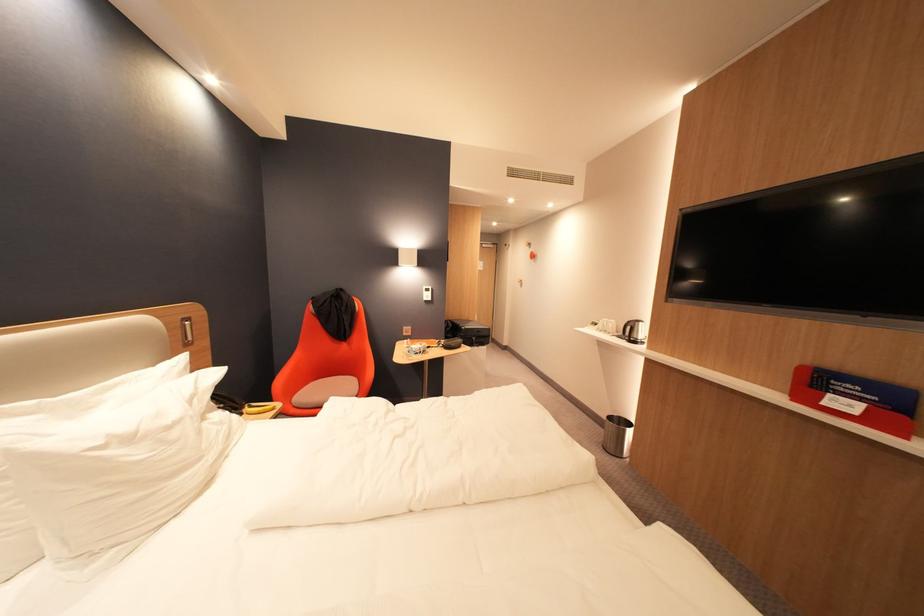
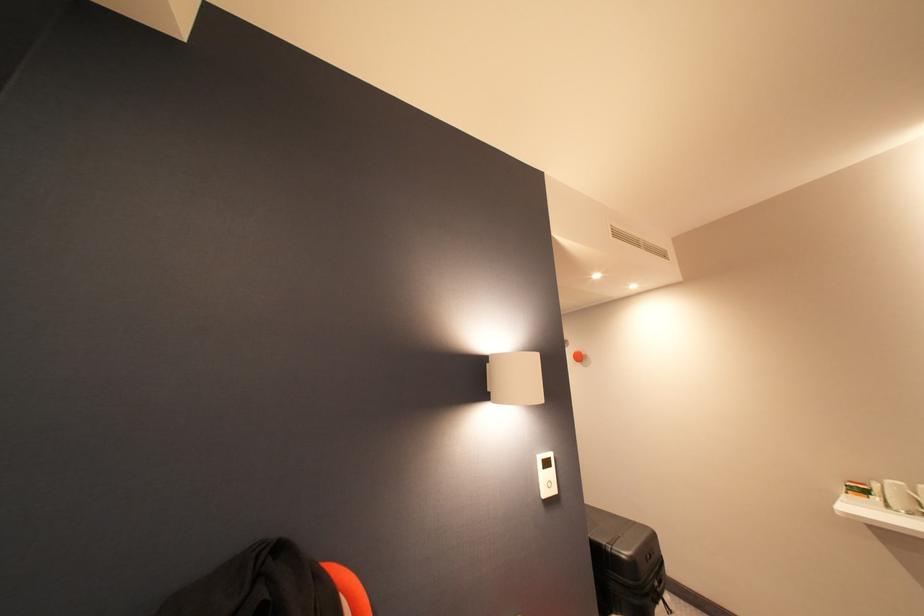
In a continuous first-person perspective shot, in which direction is the camera moving?

The movement direction of the cameraman is left, forward.